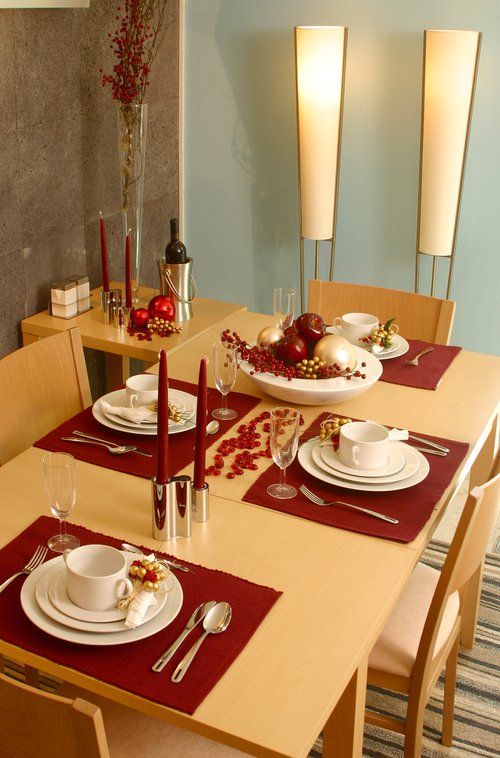
At what (x,y) coordinates should I click in order to perform the action: click on plate. Please return your answer as a coordinate pair (x, y). Looking at the image, I should click on 159,624, 394,487, 392,356, 153,433, 113,625, 381,478, 395,346, 145,424.